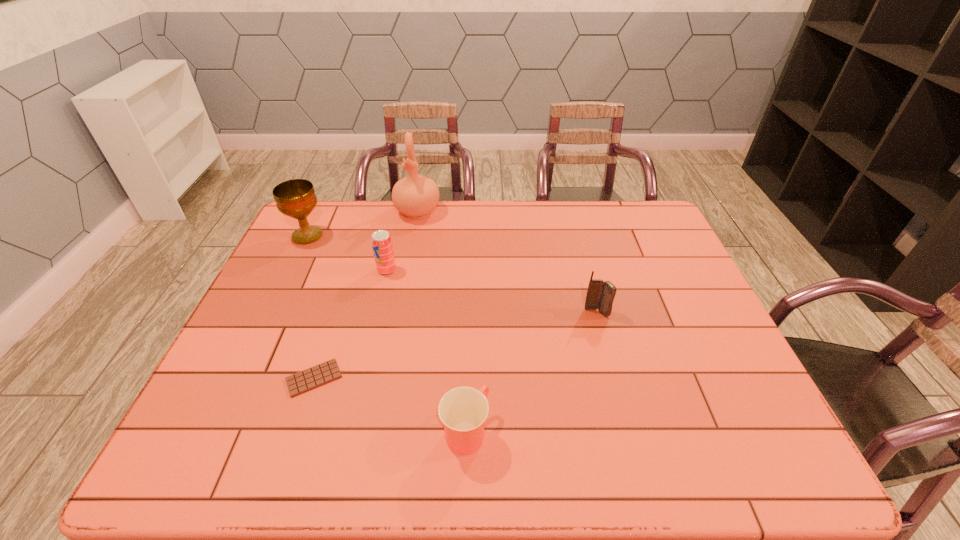
Locate an element on the screen. The height and width of the screenshot is (540, 960). vacant space located 0.400m on the spout of the pottery is located at coordinates (399, 310).

Identify the location of vacant area situated 0.160m on the right of the chalice. This screenshot has width=960, height=540. (374, 235).

This screenshot has height=540, width=960. I want to click on blank space located 0.380m on the keyboard of the cellular telephone, so click(636, 456).

This screenshot has height=540, width=960. Identify the location of vacant position located 0.240m on the front of the fourth nearest object. (371, 339).

You are a GUI agent. You are given a task and a screenshot of the screen. Output one action in this format:
    pyautogui.click(x=<x>, y=<y>)
    Task: Click on the vacant position located 0.140m on the right of the second object from right to left
    
    Given the screenshot: What is the action you would take?
    pyautogui.click(x=555, y=431)

This screenshot has width=960, height=540. Identify the location of free location located on the back of the candy bar. (329, 332).

Locate an element on the screen. pottery that is positioned at the far edge is located at coordinates (416, 196).

At what (x,y) coordinates should I click in order to perform the action: click on chalice that is at the far edge. Please return your answer as a coordinate pair (x, y). The image size is (960, 540). Looking at the image, I should click on (296, 198).

Locate an element on the screen. The height and width of the screenshot is (540, 960). object located in the near edge section of the desktop is located at coordinates (463, 410).

Where is `object that is at the left edge`? The image size is (960, 540). object that is at the left edge is located at coordinates (296, 198).